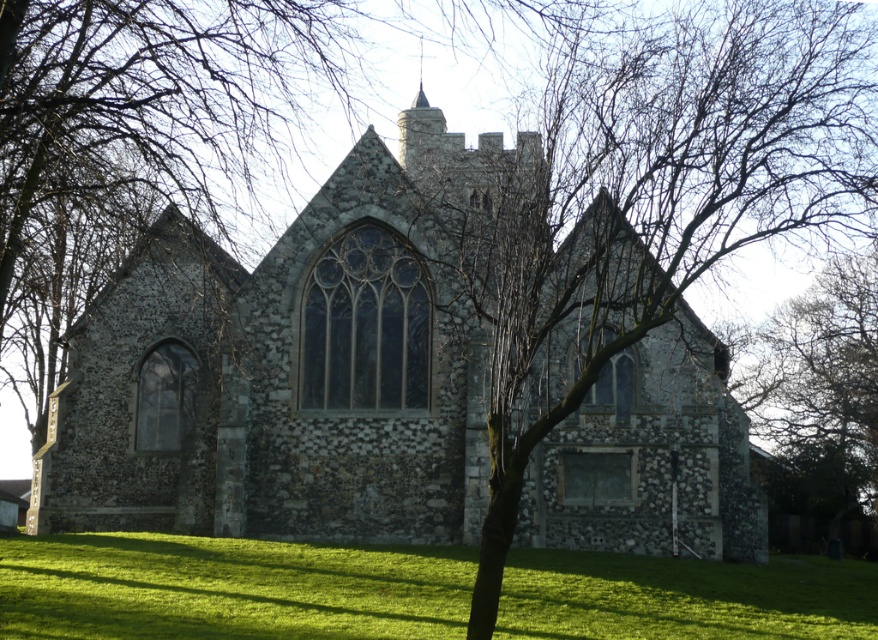
Question: Does stone church at center have a smaller size compared to green grass at lower center?

Choices:
 (A) yes
 (B) no

Answer: (B)

Question: Does stone church at center have a larger size compared to green grass at lower center?

Choices:
 (A) yes
 (B) no

Answer: (A)

Question: Among these points, which one is nearest to the camera?

Choices:
 (A) (731, 410)
 (B) (157, 600)

Answer: (B)

Question: Is stone church at center behind green grass at lower center?

Choices:
 (A) yes
 (B) no

Answer: (A)

Question: Which object appears closest to the camera in this image?

Choices:
 (A) stone church at center
 (B) green grass at lower center

Answer: (B)